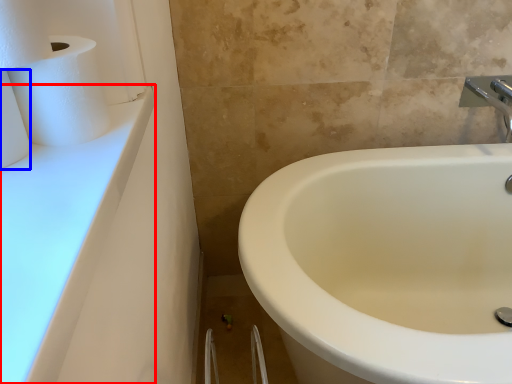
Question: Among these objects, which one is nearest to the camera, counter top (highlighted by a red box) or toilet paper (highlighted by a blue box)?

Choices:
 (A) counter top
 (B) toilet paper

Answer: (A)